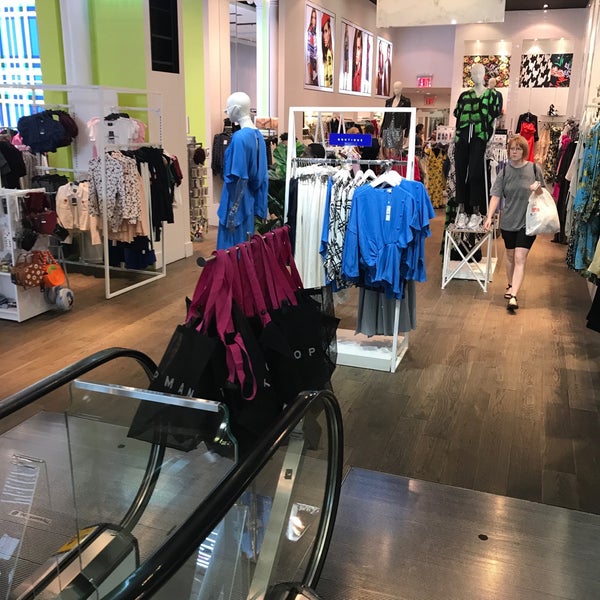
The image size is (600, 600). In order to click on clothing racks in this screenshot , I will do `click(12, 272)`, `click(120, 217)`, `click(338, 152)`, `click(537, 157)`, `click(590, 181)`, `click(447, 152)`, `click(409, 172)`.